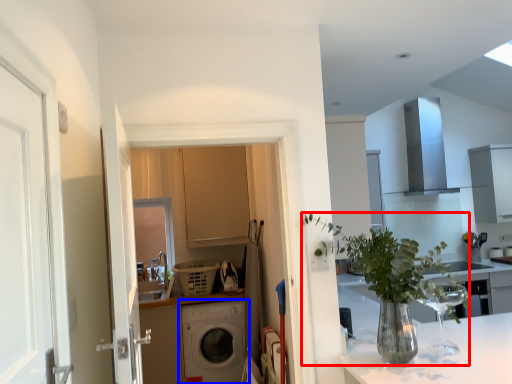
Question: Which of the following is the closest to the observer, houseplant (highlighted by a red box) or washing machine (highlighted by a blue box)?

Choices:
 (A) houseplant
 (B) washing machine

Answer: (A)